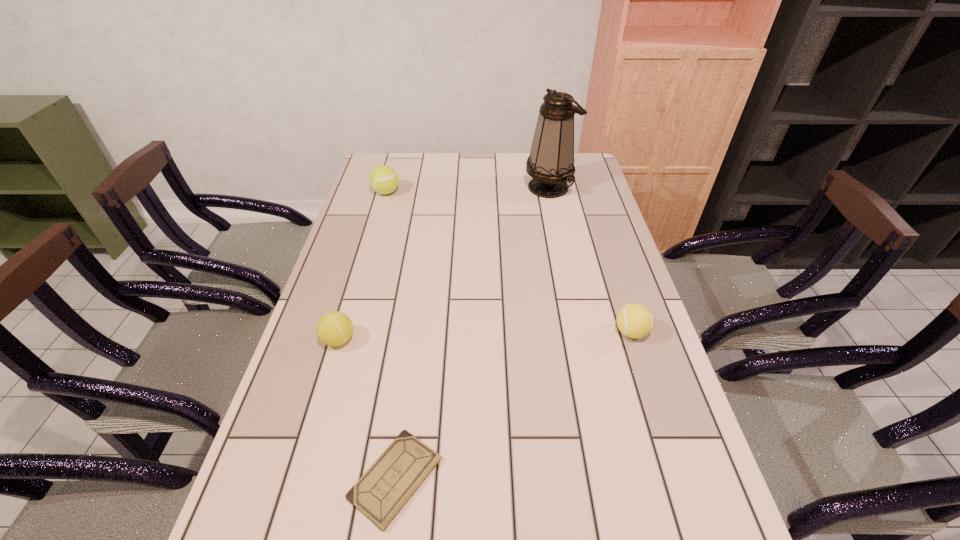
Where is `tennis ball that stands as the closest to the farthest tennis ball`? tennis ball that stands as the closest to the farthest tennis ball is located at coordinates (335, 328).

In order to click on free region that satisfies the following two spatial constraints: 1. on the back side of the nearest object; 2. on the right side of the rightmost tennis ball in this screenshot , I will do `click(416, 332)`.

Locate an element on the screen. This screenshot has width=960, height=540. free spot that satisfies the following two spatial constraints: 1. on the back side of the checkbook; 2. on the left side of the rightmost tennis ball is located at coordinates (416, 332).

Where is `vacant area in the image that satisfies the following two spatial constraints: 1. on the back side of the shortest object; 2. on the right side of the tallest object`? The image size is (960, 540). vacant area in the image that satisfies the following two spatial constraints: 1. on the back side of the shortest object; 2. on the right side of the tallest object is located at coordinates (436, 187).